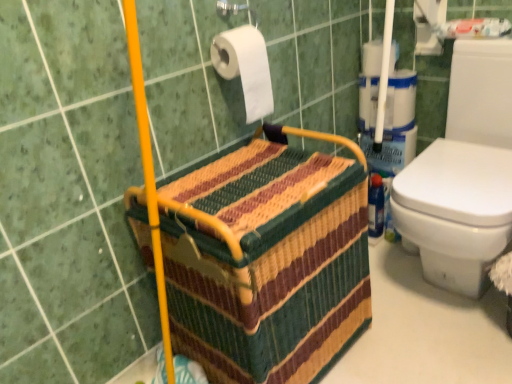
What is the approximate height of multicolored woven basket at center?

The height of multicolored woven basket at center is 26.02 inches.

How much space does white matte toilet paper at upper center, positioned as the second toilet paper in top-to-bottom order, occupy vertically?

The height of white matte toilet paper at upper center, positioned as the second toilet paper in top-to-bottom order, is 10.43 inches.

At what (x,y) coordinates should I click in order to perform the action: click on white paper at upper center, positioned as the 1th toilet paper in back-to-front order. Please return your answer as a coordinate pair (x, y). The height and width of the screenshot is (384, 512). Looking at the image, I should click on (372, 58).

Is white matte toilet paper at upper center, positioned as the second toilet paper in top-to-bottom order, wider or thinner than multicolored woven basket at center?

white matte toilet paper at upper center, positioned as the second toilet paper in top-to-bottom order, is thinner than multicolored woven basket at center.

Is multicolored woven basket at center inside white matte toilet paper at upper center, which is the 1th toilet paper from bottom to top?

No, multicolored woven basket at center is not a part of white matte toilet paper at upper center, which is the 1th toilet paper from bottom to top.

From the picture: Is white matte toilet paper at upper center, acting as the second toilet paper starting from the right, next to multicolored woven basket at center and touching it?

white matte toilet paper at upper center, acting as the second toilet paper starting from the right, is not next to multicolored woven basket at center, and they're not touching.

Who is smaller, white matte toilet paper at upper center, which is the 1th toilet paper in front-to-back order, or multicolored woven basket at center?

Smaller between the two is white matte toilet paper at upper center, which is the 1th toilet paper in front-to-back order.

Find the location of `toilet paper above the white matte toilet paper at upper center, which is the 1th toilet paper in left-to-right order (from the image's perspective)`. toilet paper above the white matte toilet paper at upper center, which is the 1th toilet paper in left-to-right order (from the image's perspective) is located at coordinates (372, 58).

How different are the orientations of white matte toilet paper at upper center, which is the 1th toilet paper from bottom to top, and white paper at upper center, which is the 2th toilet paper from front to back, in degrees?

They differ by 90.9 degrees in their facing directions.

Looking at this image, considering the relative sizes of white matte toilet paper at upper center, which is the 1th toilet paper from bottom to top, and white paper at upper center, which is the 2th toilet paper from front to back, in the image provided, is white matte toilet paper at upper center, which is the 1th toilet paper from bottom to top, bigger than white paper at upper center, which is the 2th toilet paper from front to back,?

Correct, white matte toilet paper at upper center, which is the 1th toilet paper from bottom to top, is larger in size than white paper at upper center, which is the 2th toilet paper from front to back.

Is white matte toilet paper at upper center, which is the 2th toilet paper from back to front, not close to white paper at upper center, which ranks as the 2th toilet paper in bottom-to-top order?

They are positioned close to each other.

Between multicolored woven basket at center and white paper at upper center, which is the 2th toilet paper from front to back, which one has less height?

white paper at upper center, which is the 2th toilet paper from front to back.

Can we say multicolored woven basket at center lies outside white paper at upper center, which ranks as the 2th toilet paper in bottom-to-top order?

Yes, multicolored woven basket at center is located beyond the bounds of white paper at upper center, which ranks as the 2th toilet paper in bottom-to-top order.

From the image's perspective, which is below, multicolored woven basket at center or white paper at upper center, which is counted as the 1th toilet paper, starting from the right?

multicolored woven basket at center.

From the image's perspective, which one is positioned higher, white paper at upper center, which is counted as the 1th toilet paper, starting from the right, or multicolored woven basket at center?

white paper at upper center, which is counted as the 1th toilet paper, starting from the right, is shown above in the image.

How different are the orientations of white paper at upper center, which is the 2th toilet paper from front to back, and multicolored woven basket at center in degrees?

90.7 degrees.

Can you confirm if white paper at upper center, positioned as the 1th toilet paper in back-to-front order, is smaller than multicolored woven basket at center?

Yes.

Which of these two, multicolored woven basket at center or white matte toilet paper at upper center, which is the 1th toilet paper in front-to-back order, stands taller?

multicolored woven basket at center is taller.

Is multicolored woven basket at center positioned far away from white matte toilet paper at upper center, which is the 2th toilet paper from back to front?

That's not correct — multicolored woven basket at center is a little close to white matte toilet paper at upper center, which is the 2th toilet paper from back to front.

Is multicolored woven basket at center to the left of white matte toilet paper at upper center, which is the 2th toilet paper from back to front, from the viewer's perspective?

No.

Is point (214, 321) closer or farther from the camera than point (234, 67)?

Point (214, 321) appears to be closer to the viewer than point (234, 67).

Which of these two, white paper at upper center, which ranks as the 2th toilet paper in bottom-to-top order, or white matte toilet paper at upper center, which is the 1th toilet paper in left-to-right order, is smaller?

With smaller size is white paper at upper center, which ranks as the 2th toilet paper in bottom-to-top order.

Where is `toilet paper lying below the white paper at upper center, positioned as the 1th toilet paper in back-to-front order (from the image's perspective)`? toilet paper lying below the white paper at upper center, positioned as the 1th toilet paper in back-to-front order (from the image's perspective) is located at coordinates (245, 67).

From the image's perspective, which is above, white paper at upper center, positioned as the 1th toilet paper in back-to-front order, or white matte toilet paper at upper center, acting as the second toilet paper starting from the right?

white paper at upper center, positioned as the 1th toilet paper in back-to-front order, appears higher in the image.

Looking at this image, considering the positions of objects white paper at upper center, positioned as the 1th toilet paper in back-to-front order, and white matte toilet paper at upper center, positioned as the second toilet paper in top-to-bottom order, in the image provided, who is more to the left, white paper at upper center, positioned as the 1th toilet paper in back-to-front order, or white matte toilet paper at upper center, positioned as the second toilet paper in top-to-bottom order,?

white matte toilet paper at upper center, positioned as the second toilet paper in top-to-bottom order, is more to the left.

Locate an element on the screen. the 2nd toilet paper above the multicolored woven basket at center (from a real-world perspective) is located at coordinates (245, 67).

The height and width of the screenshot is (384, 512). In order to click on toilet paper above the white matte toilet paper at upper center, which is the 2th toilet paper from back to front (from the image's perspective) in this screenshot , I will do `click(372, 58)`.

When comparing their distances from multicolored woven basket at center, does white paper at upper center, the 2th toilet paper in the left-to-right sequence, or white matte toilet paper at upper center, which is the 1th toilet paper in front-to-back order, seem further?

white paper at upper center, the 2th toilet paper in the left-to-right sequence, is positioned further to the anchor multicolored woven basket at center.

Estimate the real-world distances between objects in this image. Which object is closer to white paper at upper center, positioned as the 1th toilet paper in back-to-front order, multicolored woven basket at center or white matte toilet paper at upper center, which is the 1th toilet paper in front-to-back order?

The object closer to white paper at upper center, positioned as the 1th toilet paper in back-to-front order, is white matte toilet paper at upper center, which is the 1th toilet paper in front-to-back order.

Considering their positions, is multicolored woven basket at center positioned further to white matte toilet paper at upper center, positioned as the second toilet paper in top-to-bottom order, than white paper at upper center, which ranks as the 2th toilet paper in bottom-to-top order?

Among the two, white paper at upper center, which ranks as the 2th toilet paper in bottom-to-top order, is located further to white matte toilet paper at upper center, positioned as the second toilet paper in top-to-bottom order.

From the image, which object appears to be nearer to white matte toilet paper at upper center, which is the 1th toilet paper in front-to-back order, white paper at upper center, the first toilet paper positioned from the top, or multicolored woven basket at center?

multicolored woven basket at center is closer to white matte toilet paper at upper center, which is the 1th toilet paper in front-to-back order.

When comparing their distances from white paper at upper center, which is the 2th toilet paper from front to back, does white matte toilet paper at upper center, which is the 1th toilet paper from bottom to top, or multicolored woven basket at center seem further?

multicolored woven basket at center.

When comparing their distances from multicolored woven basket at center, does white matte toilet paper at upper center, positioned as the second toilet paper in top-to-bottom order, or white paper at upper center, which is the 2th toilet paper from front to back, seem further?

The object further to multicolored woven basket at center is white paper at upper center, which is the 2th toilet paper from front to back.

Where is `toilet paper between multicolored woven basket at center and white paper at upper center, the 2th toilet paper in the left-to-right sequence, along the z-axis`? This screenshot has width=512, height=384. toilet paper between multicolored woven basket at center and white paper at upper center, the 2th toilet paper in the left-to-right sequence, along the z-axis is located at coordinates (245, 67).